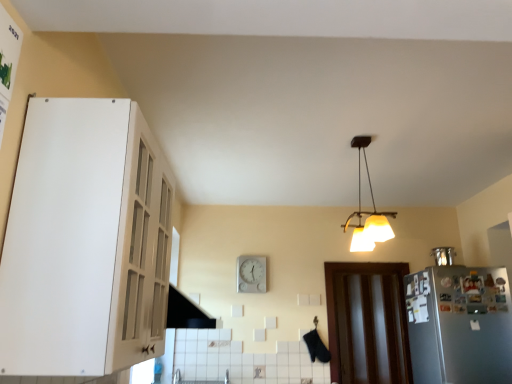
At what (x,y) coordinates should I click in order to perform the action: click on blank space situated above brown wooden door at lower right (from a real-world perspective). Please return your answer as a coordinate pair (x, y). Looking at the image, I should click on (366, 262).